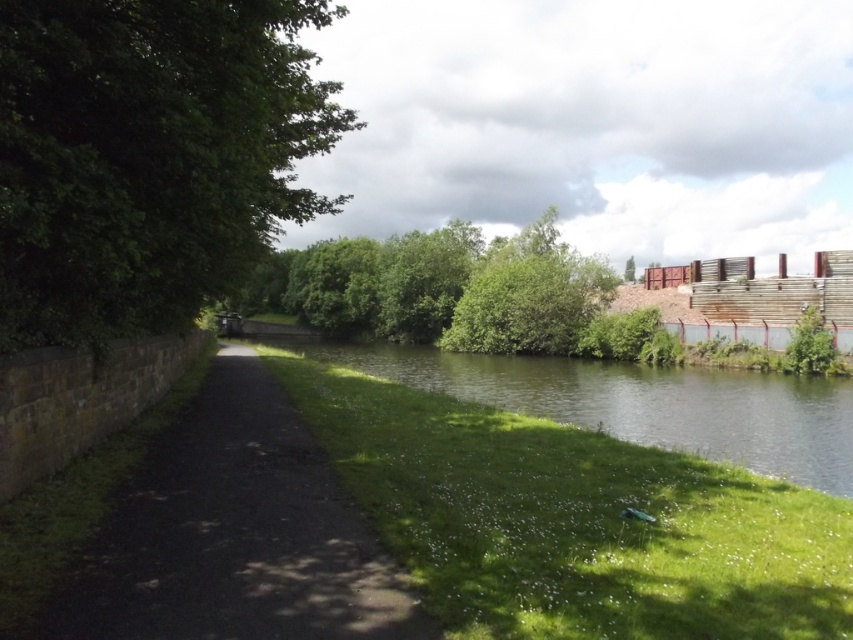
You are a hiker who wants to take a photo of the green leafy tree at left and the green grassy bank at lower center. Which object should you focus on first if you want to capture both in a single frame without moving your camera?

The green leafy tree at left is taller than the green grassy bank at lower center, so you should focus on the green leafy tree at left first to ensure it fits within the frame.

You are standing at the center of the image and want to walk towards the green leafy tree at left. Which direction should you move?

The green leafy tree at left is located at the left side of the image, so you should move to the left to reach it.